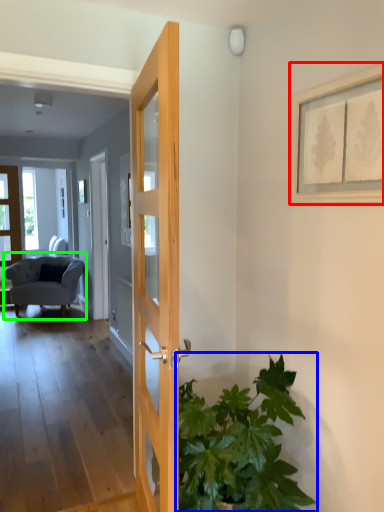
Question: Which object is positioned closest to picture frame (highlighted by a red box)? Select from houseplant (highlighted by a blue box) and chair (highlighted by a green box).

Choices:
 (A) houseplant
 (B) chair

Answer: (A)